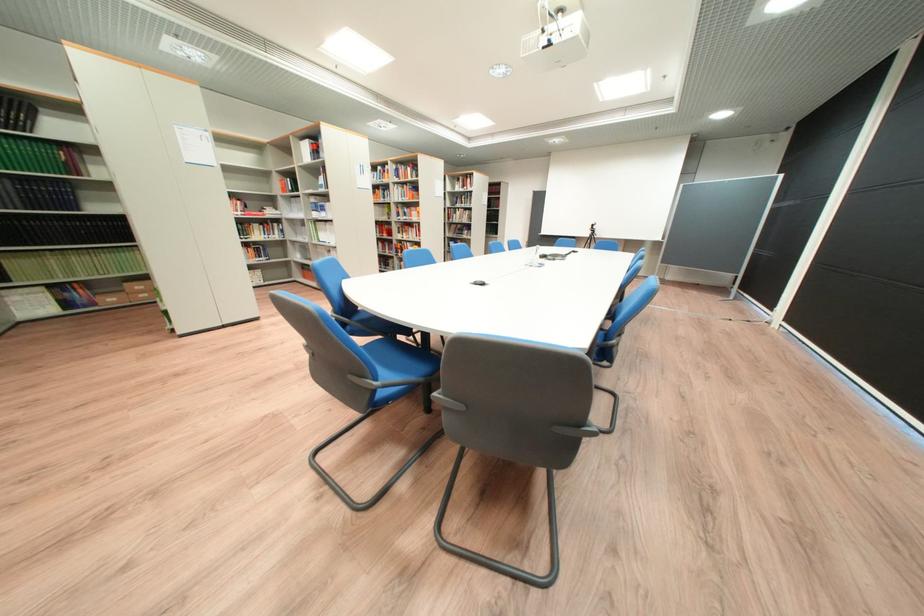
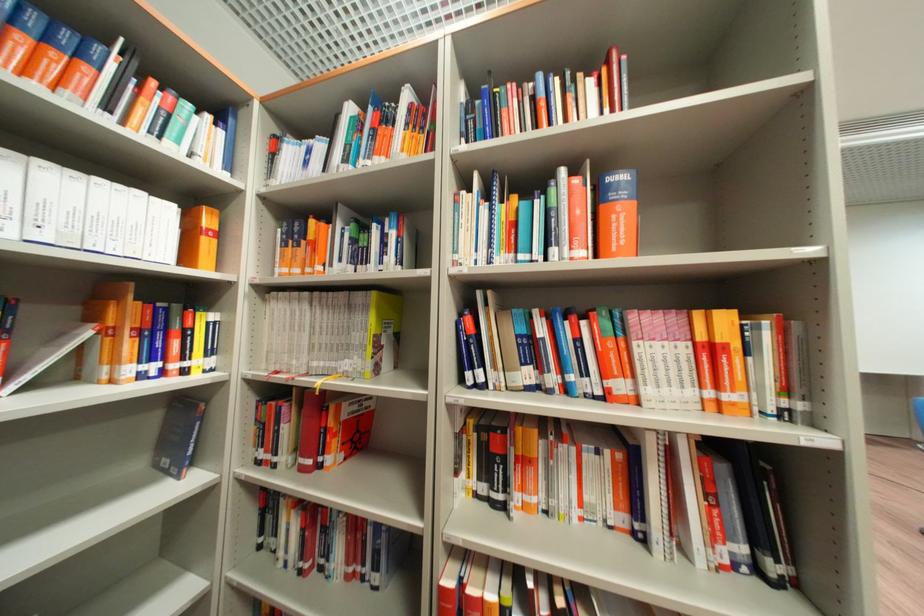
The point at [397,211] is marked in the first image. Where is the corresponding point in the second image?

(380, 323)